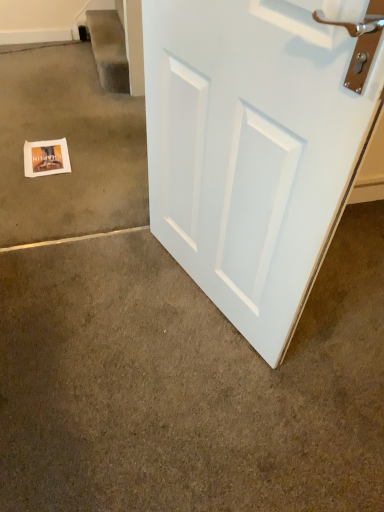
Locate an element on the screen. vacant space situated above matte paper postcard at lower left (from a real-world perspective) is located at coordinates (44, 154).